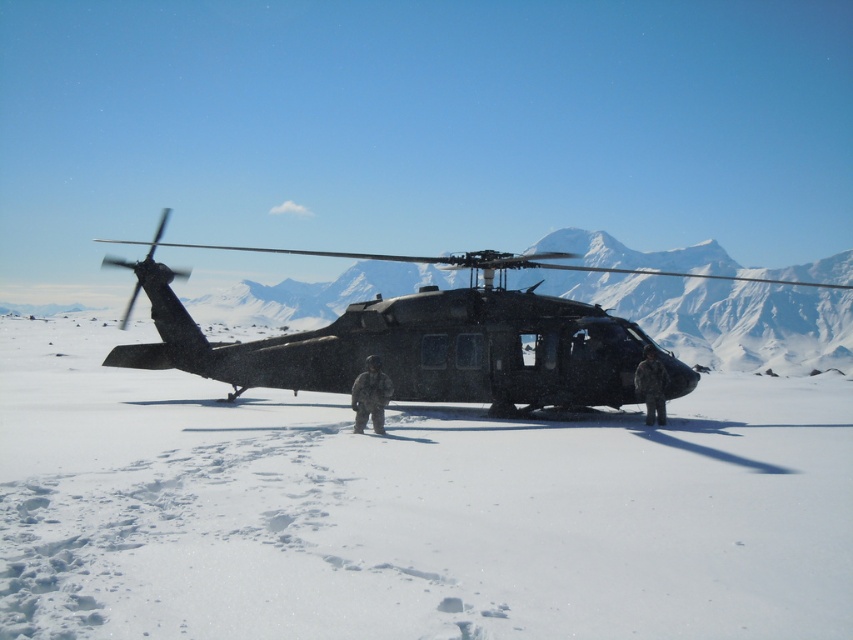
You are a military engineer assessing the helicopter landing zone. The white powdery snow at center and the matte black helicopter at center are both in your view. Which object is positioned lower in the image?

The white powdery snow at center is located below the matte black helicopter at center, so it is positioned lower in the image.

You are a photographer planning to take a photo of the two military personnel in the snowy landscape. You need to ensure that both the camouflage uniform at center and the camouflage fabric uniform at right are clearly visible. Given their sizes, which uniform should you focus on to ensure it stands out more in the photo?

The camouflage fabric uniform at right should be focused on to ensure it stands out more in the photo because it has a larger size compared to the camouflage uniform at center.